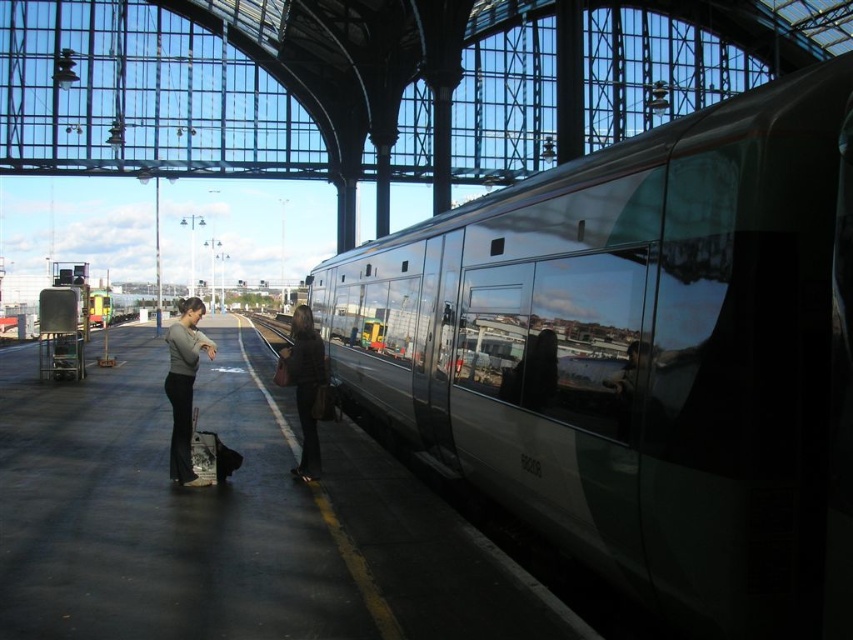
You are standing at the entrance of the train station and want to reach the train on the right side. According to the image, where is the smooth concrete platform at center located?

The smooth concrete platform at center is located at point (229, 520).

You are a person carrying a large suitcase and need to walk from the train on the right to the exit at the far end of the platform. The smooth concrete platform at center and the matte gray sweater at left are in your path. Which object in your path has a greater width?

The smooth concrete platform at center has a greater width than the matte gray sweater at left according to the description.